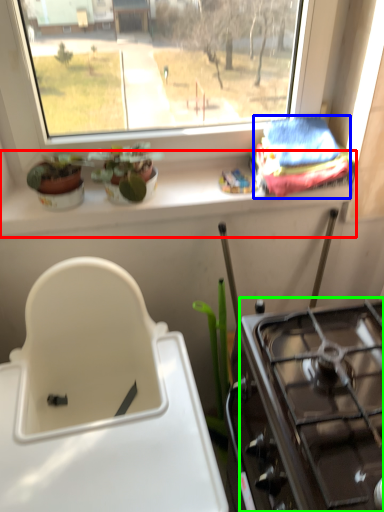
Question: Which object is positioned closest to window sill (highlighted by a red box)? Select from material (highlighted by a blue box) and gas stove (highlighted by a green box).

Choices:
 (A) material
 (B) gas stove

Answer: (A)